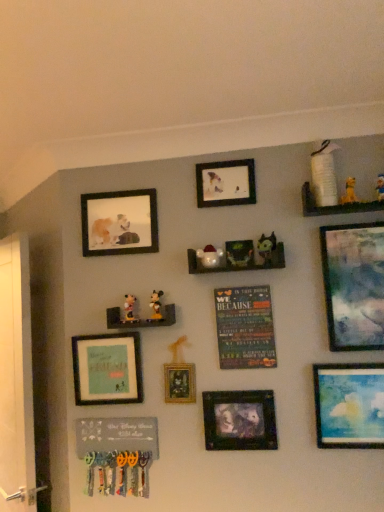
Question: From a real-world perspective, is matte glass painting at upper right, acting as the 1th picture frame starting from the right, positioned above or below matte blue painting at lower right, which is the second picture frame in right-to-left order?

Choices:
 (A) below
 (B) above

Answer: (B)

Question: Is matte glass painting at upper right, acting as the 1th picture frame starting from the right, to the left or to the right of matte blue painting at lower right, marked as the sixth picture frame in a left-to-right arrangement, in the image?

Choices:
 (A) left
 (B) right

Answer: (B)

Question: Which of these objects is positioned closest to the matte green frame at center-left, which is the 1th picture frame in left-to-right order?

Choices:
 (A) white wooden screen door at left
 (B) green matte shelf at upper right, which ranks as the first shelf in top-to-bottom order
 (C) yellow plush toy at upper right, which is the fifth toy from left to right
 (D) matte blue painting at lower right, which is the second picture frame in right-to-left order
 (E) yellow plush toy at upper right, the 6th toy positioned from the left

Answer: (A)

Question: Based on their relative distances, which object is farther from the metallic silver frame at lower center, which appears as the 5th picture frame when viewed from the left?

Choices:
 (A) matte wooden picture frame at upper left, positioned as the 6th picture frame in right-to-left order
 (B) yellow plush toy at upper right, positioned as the second toy in right-to-left order
 (C) matte plastic mickey mouse at center, positioned as the sixth toy in right-to-left order
 (D) yellow plush toy at upper right, the 6th toy positioned from the left
 (E) matte blue painting at lower right, marked as the sixth picture frame in a left-to-right arrangement

Answer: (D)